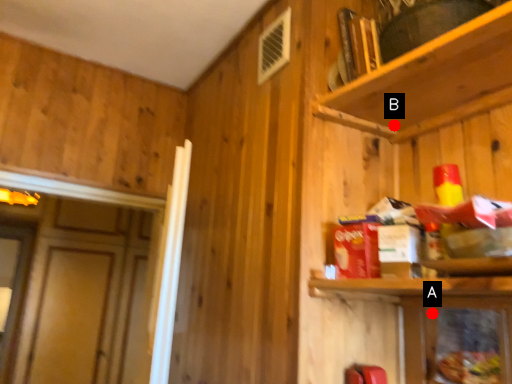
Question: Two points are circled on the image, labeled by A and B beside each circle. Which of the following is the farthest from the observer?

Choices:
 (A) A is further
 (B) B is further

Answer: (B)